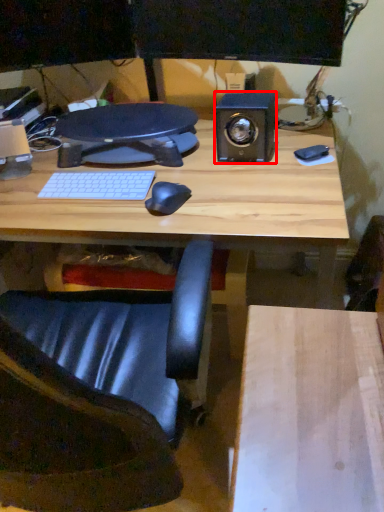
Question: From the image's perspective, what is the correct spatial positioning of speaker (annotated by the red box) in reference to chair?

Choices:
 (A) below
 (B) above

Answer: (B)